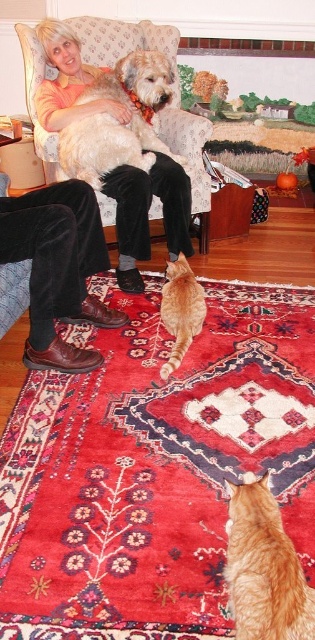
How much distance is there between velvet armchair at upper center and soft golden fur at center?

velvet armchair at upper center and soft golden fur at center are 10.62 inches apart from each other.

What do you see at coordinates (173, 86) in the screenshot?
I see `velvet armchair at upper center` at bounding box center [173, 86].

Is point (119, 58) closer to camera compared to point (95, 164)?

No.

In order to click on velvet armchair at upper center in this screenshot , I will do `click(173, 86)`.

Is velvet armchair at upper center above orange fur cat at center?

Yes, velvet armchair at upper center is above orange fur cat at center.

Does velvet armchair at upper center appear on the right side of orange fur cat at center?

No, velvet armchair at upper center is not to the right of orange fur cat at center.

What do you see at coordinates (173, 86) in the screenshot? I see `velvet armchair at upper center` at bounding box center [173, 86].

Find the location of a particular element. The width and height of the screenshot is (315, 640). velvet armchair at upper center is located at coordinates (173, 86).

Is tabby fur cat at lower center below soft golden fur at center?

Yes.

Can you confirm if tabby fur cat at lower center is taller than soft golden fur at center?

Incorrect, tabby fur cat at lower center's height is not larger of soft golden fur at center's.

At what (x,y) coordinates should I click in order to perform the action: click on tabby fur cat at lower center. Please return your answer as a coordinate pair (x, y). The width and height of the screenshot is (315, 640). Looking at the image, I should click on (263, 566).

I want to click on tabby fur cat at lower center, so click(x=263, y=566).